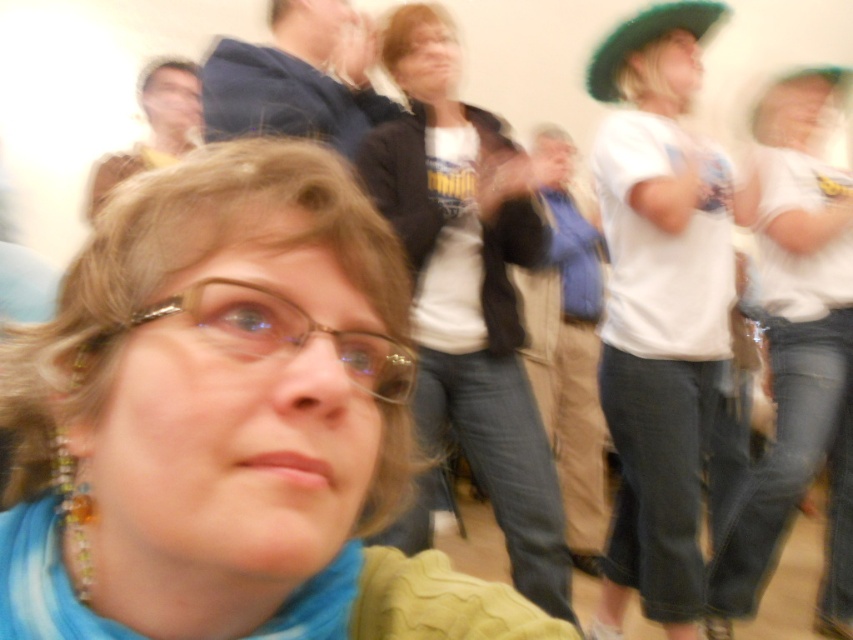
Question: Which point is farther from the camera taking this photo?

Choices:
 (A) tap(612, 289)
 (B) tap(222, 289)
 (C) tap(270, 92)

Answer: (A)

Question: Where is white matte shirt at center located in relation to blue fabric at upper center in the image?

Choices:
 (A) left
 (B) right

Answer: (B)

Question: Can you confirm if matte blue scarf at center is smaller than clear plastic glasses at center?

Choices:
 (A) no
 (B) yes

Answer: (A)

Question: Among these objects, which one is farthest from the camera?

Choices:
 (A) blue fabric at upper center
 (B) clear plastic glasses at center
 (C) blue fabric scarf at lower left

Answer: (A)

Question: Considering the relative positions of matte blue scarf at center and clear plastic glasses at center in the image provided, where is matte blue scarf at center located with respect to clear plastic glasses at center?

Choices:
 (A) below
 (B) above

Answer: (A)

Question: Which object is positioned farthest from the clear plastic glasses at center?

Choices:
 (A) white cotton shirt at center
 (B) blue fabric at upper center
 (C) matte blue scarf at center
 (D) green felt hat at upper right

Answer: (D)